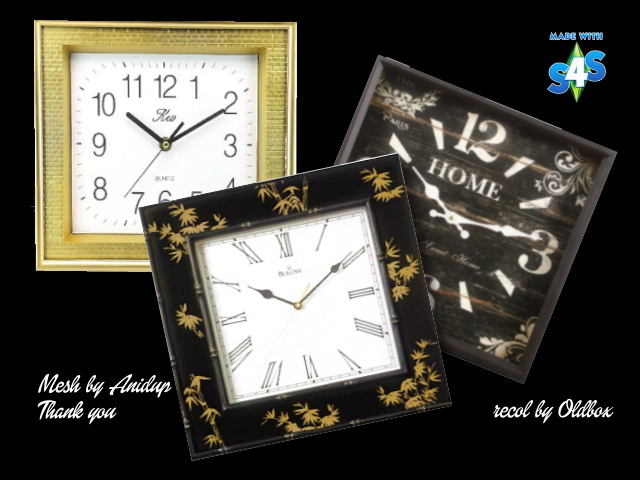
Image resolution: width=640 pixels, height=480 pixels. I want to click on clock, so click(269, 331), click(472, 195), click(204, 135).